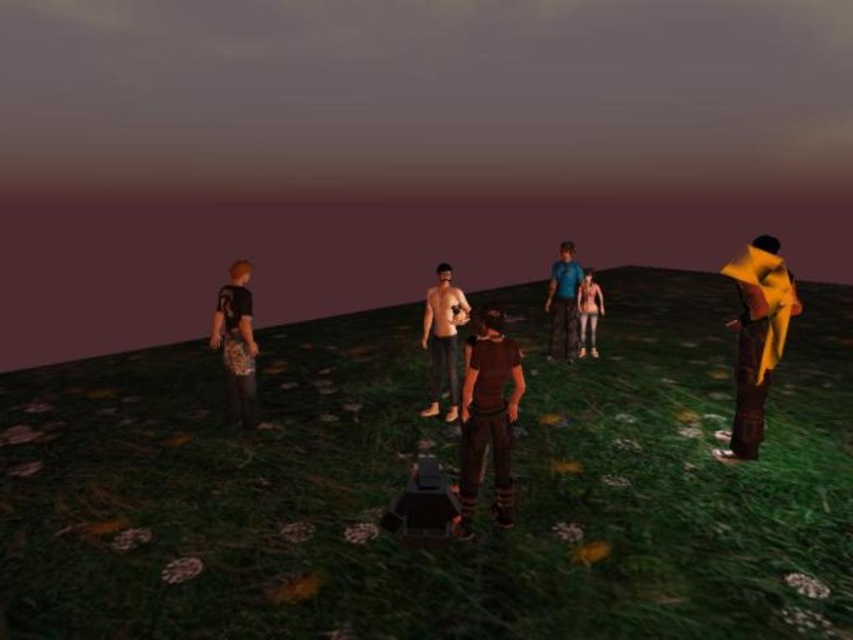
You are a character in the scene and want to determine which object is smaller between the brown matte shirt at center and the leopard print pants at left. Which one is smaller?

The brown matte shirt at center is smaller compared to the leopard print pants at left.

You are a photographer trying to capture a group photo of the blue fabric shirt at center and the leather jacket at center. Which one of these two will appear smaller in the photo?

The blue fabric shirt at center will appear smaller in the photo because it occupies less space than the leather jacket at center.